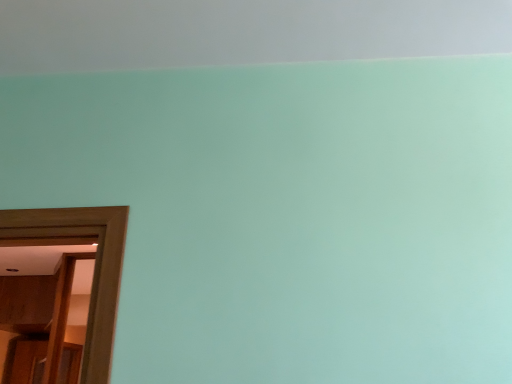
Measure the distance between wooden door at left and camera.

The depth of wooden door at left is 1.08 meters.

You are a GUI agent. You are given a task and a screenshot of the screen. Output one action in this format:
    pyautogui.click(x=<x>, y=<y>)
    Task: Click on the wooden door at left
    
    Given the screenshot: What is the action you would take?
    pyautogui.click(x=95, y=269)

Describe the element at coordinates (95, 269) in the screenshot. This screenshot has width=512, height=384. I see `wooden door at left` at that location.

Find the location of a particular element. wooden door at left is located at coordinates (95, 269).